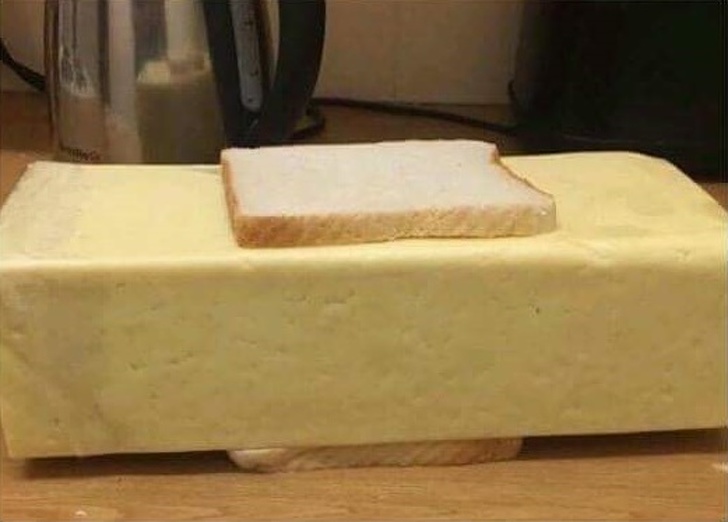
Where is `table`? This screenshot has height=522, width=728. table is located at coordinates (600, 492), (231, 493).